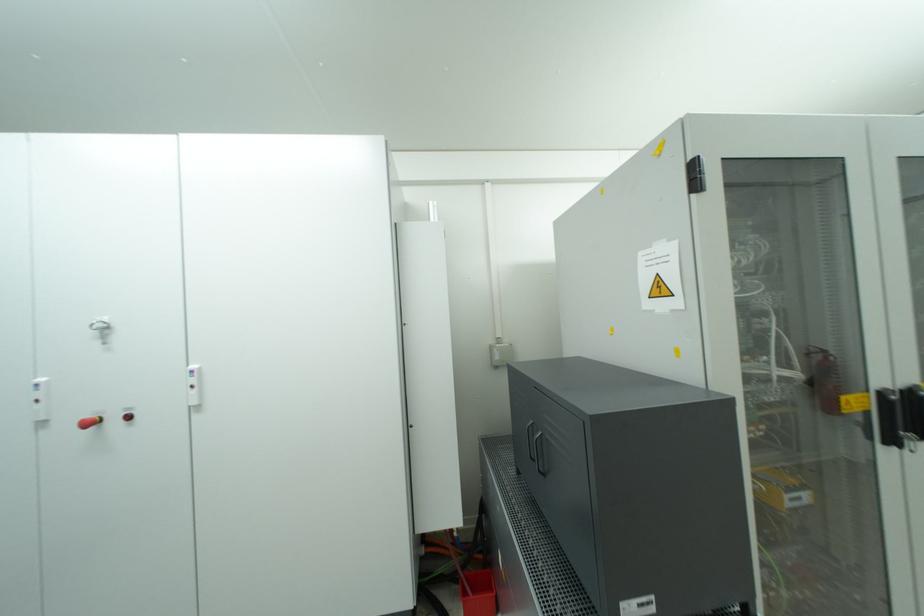
Describe the element at coordinates (128, 416) in the screenshot. I see `a small black button` at that location.